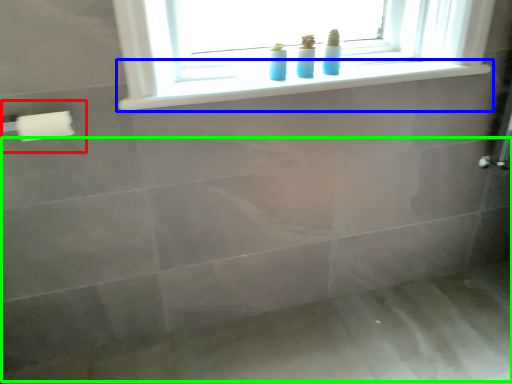
Question: Estimate the real-world distances between objects in this image. Which object is farther from towel bar (highlighted by a red box), window sill (highlighted by a blue box) or bath (highlighted by a green box)?

Choices:
 (A) window sill
 (B) bath

Answer: (B)